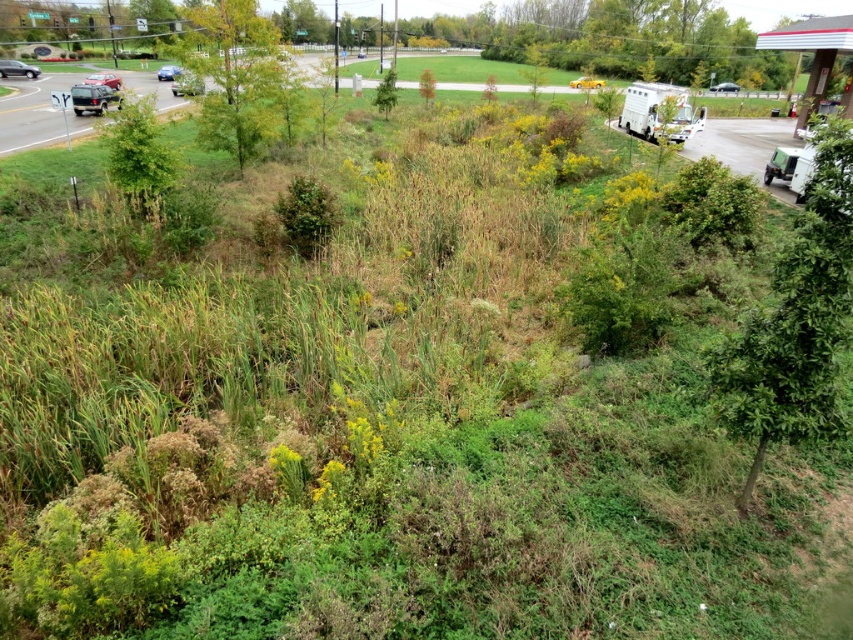
Question: In this image, where is white matte recreational vehicle at upper right located relative to yellow plastic recreational vehicle at upper center?

Choices:
 (A) left
 (B) right

Answer: (B)

Question: Among these objects, which one is farthest from the camera?

Choices:
 (A) matte black suv at left
 (B) green leafy tree at upper left
 (C) matte black truck at upper left
 (D) metallic blue sedan at upper left

Answer: (D)

Question: In this image, where is green leafy tree at upper left located relative to metallic red car at upper left?

Choices:
 (A) above
 (B) below

Answer: (A)

Question: Which of these objects is positioned closest to the green leafy tree at upper left?

Choices:
 (A) metallic red car at upper left
 (B) green leafy tree at right
 (C) yellow plastic recreational vehicle at upper center
 (D) matte black suv at upper left

Answer: (A)

Question: Among these points, which one is farthest from the camera?

Choices:
 (A) (598, 83)
 (B) (798, 403)
 (C) (84, 92)
 (D) (19, 72)

Answer: (A)

Question: Can you confirm if matte black suv at upper left is positioned above metallic blue sedan at upper left?

Choices:
 (A) no
 (B) yes

Answer: (A)